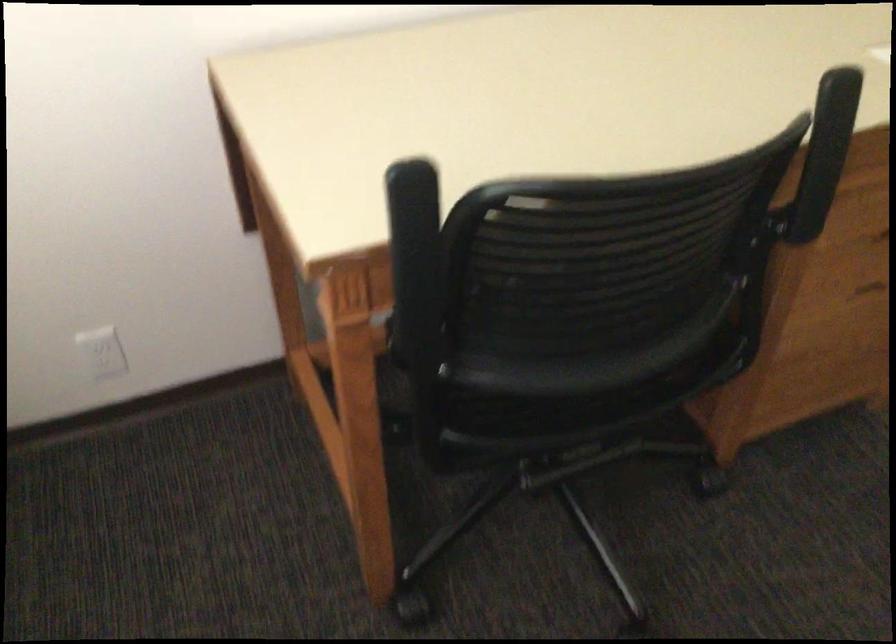
Which object does [101,352] point to?

It refers to a white electrical outlet.